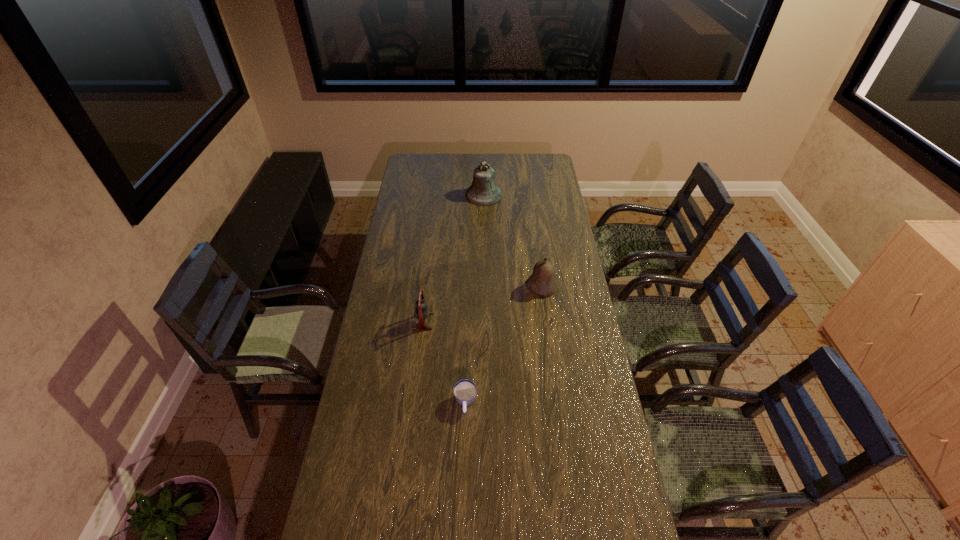
I want to click on vacant space situated 0.270m on the back of the second nearest bell, so click(x=535, y=237).

Identify the location of vacant space situated 0.110m on the side of the shortest object with the handle. (464, 448).

Locate an element on the screen. The height and width of the screenshot is (540, 960). object that is at the right edge is located at coordinates point(541,282).

In the image, there is a desktop. Where is `vacant space at the left edge`? The height and width of the screenshot is (540, 960). vacant space at the left edge is located at coordinates (396, 308).

This screenshot has height=540, width=960. I want to click on vacant space at the right edge of the desktop, so click(x=579, y=383).

This screenshot has width=960, height=540. What are the coordinates of `unoccupied position between the tallest bell and the nearest object` in the screenshot? It's located at (474, 299).

Find the location of a particular element. This screenshot has height=540, width=960. free space between the second farthest bell and the leftmost bell is located at coordinates (482, 304).

The image size is (960, 540). In order to click on free spot between the shortest object and the nearest bell in this screenshot , I will do click(x=444, y=362).

Locate an element on the screen. The height and width of the screenshot is (540, 960). free area in between the nearest bell and the rightmost object is located at coordinates (482, 304).

At what (x,y) coordinates should I click in order to perform the action: click on vacant space in between the shortest object and the leftmost object. Please return your answer as a coordinate pair (x, y). The image size is (960, 540). Looking at the image, I should click on (444, 362).